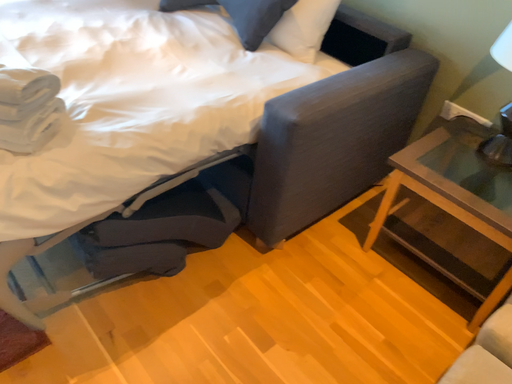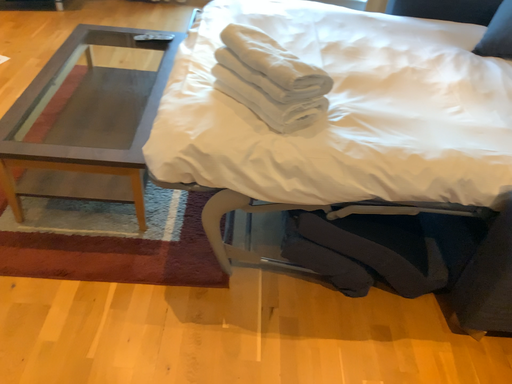
Question: How did the camera likely rotate when shooting the video?

Choices:
 (A) rotated upward
 (B) rotated downward

Answer: (A)